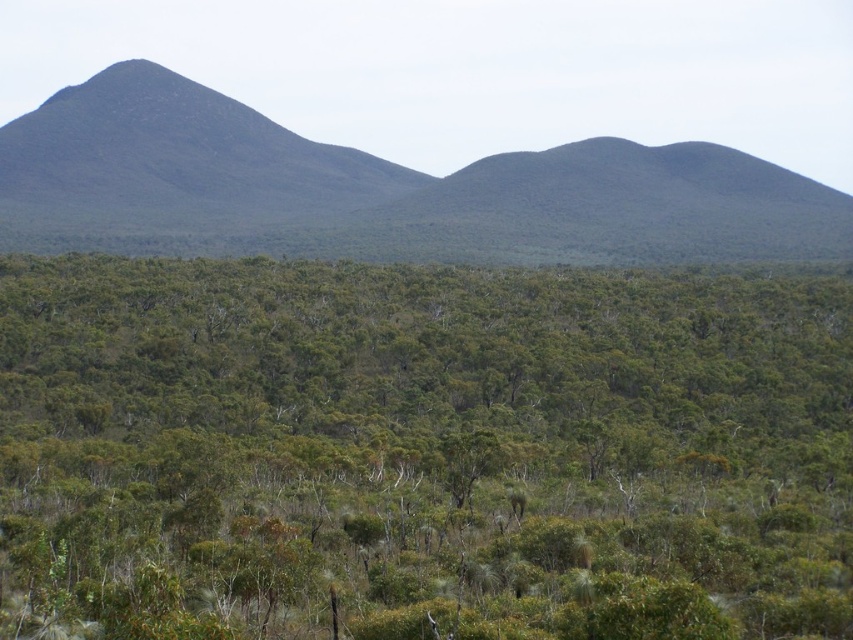
Who is taller, green leafy shrub at center or dark brown rocky mountain at left?

Standing taller between the two is dark brown rocky mountain at left.

Who is positioned more to the right, green leafy shrub at center or dark brown rocky mountain at left?

green leafy shrub at center

What do you see at coordinates (421, 451) in the screenshot? I see `green leafy shrub at center` at bounding box center [421, 451].

Image resolution: width=853 pixels, height=640 pixels. Find the location of `green leafy shrub at center`. green leafy shrub at center is located at coordinates (421, 451).

Is dark green textured mountain at left to the right of dark brown rocky mountain at left from the viewer's perspective?

Correct, you'll find dark green textured mountain at left to the right of dark brown rocky mountain at left.

Which is more to the right, dark green textured mountain at left or dark brown rocky mountain at left?

dark green textured mountain at left

Is point (61, 179) positioned before point (200, 122)?

Yes, point (61, 179) is closer to viewer.

I want to click on dark green textured mountain at left, so click(x=379, y=189).

Between green leafy shrub at center and dark green textured mountain at left, which one has less height?

With less height is green leafy shrub at center.

Can you confirm if green leafy shrub at center is shorter than dark green textured mountain at left?

Correct, green leafy shrub at center is not as tall as dark green textured mountain at left.

Which is behind, point (53, 561) or point (819, 224)?

Point (819, 224)

Find the location of a particular element. The height and width of the screenshot is (640, 853). green leafy shrub at center is located at coordinates (421, 451).